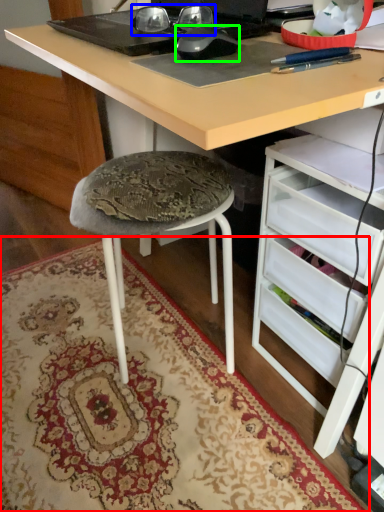
Question: Estimate the real-world distances between objects in this image. Which object is closer to mat (highlighted by a red box), glasses (highlighted by a blue box) or mouse (highlighted by a green box)?

Choices:
 (A) glasses
 (B) mouse

Answer: (B)